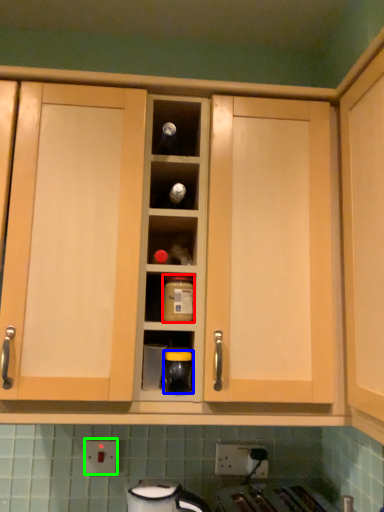
Question: Which is nearer to the bottle (highlighted by a red box)? appliance (highlighted by a blue box) or electric outlet (highlighted by a green box).

Choices:
 (A) appliance
 (B) electric outlet

Answer: (A)